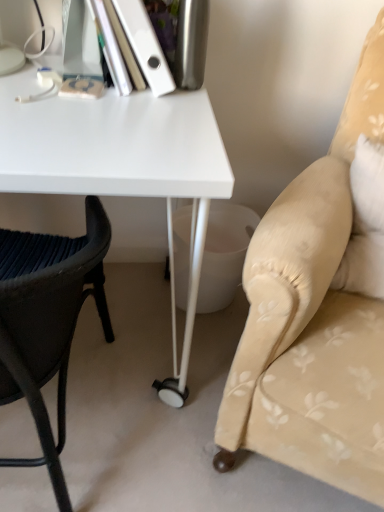
Where is `free point above white glossy desk at center (from a real-world perspective)`? free point above white glossy desk at center (from a real-world perspective) is located at coordinates (77, 85).